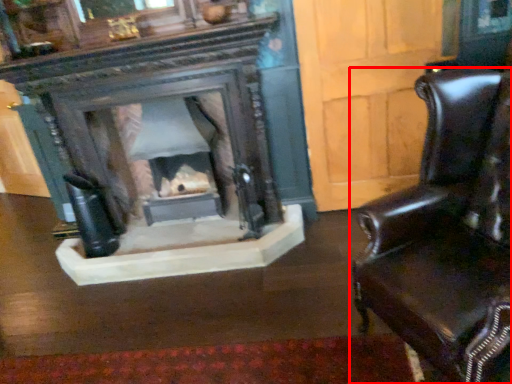
Question: From the image's perspective, considering the relative positions of chair (annotated by the red box) and fireplace in the image provided, where is chair (annotated by the red box) located with respect to the staircase?

Choices:
 (A) below
 (B) above

Answer: (A)